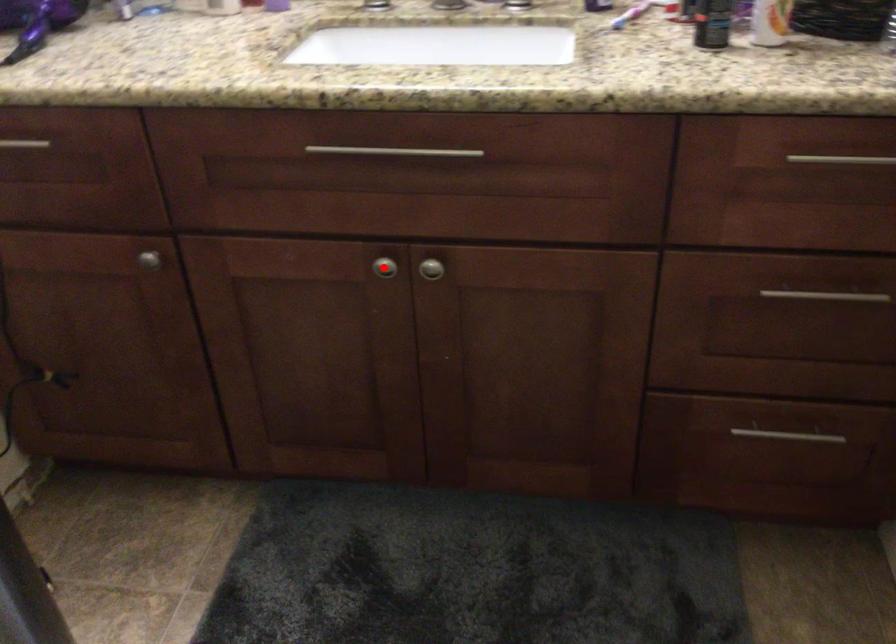
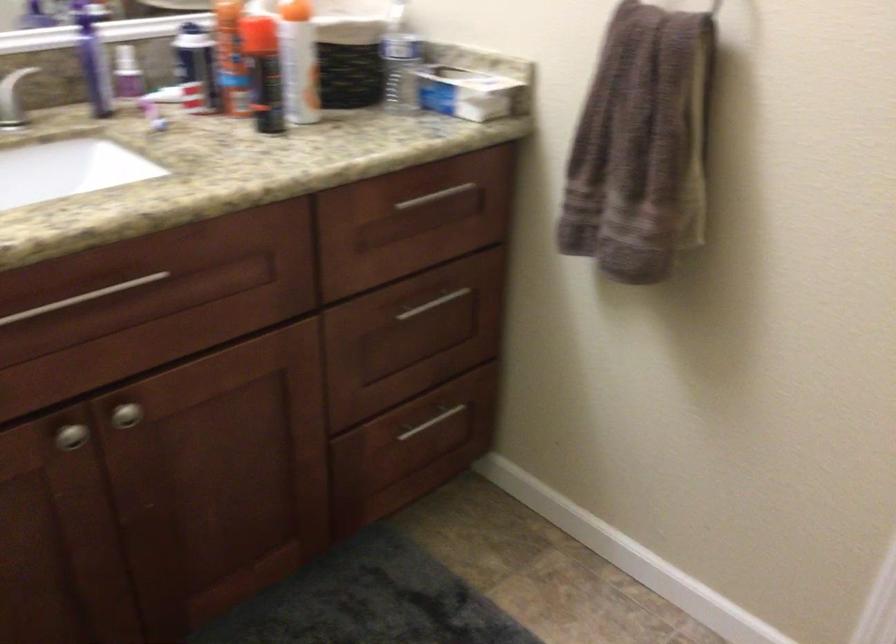
Where in the second image is the point corresponding to the highlighted location from the first image?

(71, 436)